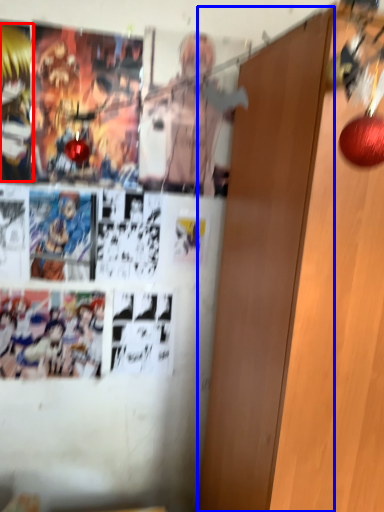
Question: Among these objects, which one is nearest to the camera, person (highlighted by a red box) or door (highlighted by a blue box)?

Choices:
 (A) person
 (B) door

Answer: (B)